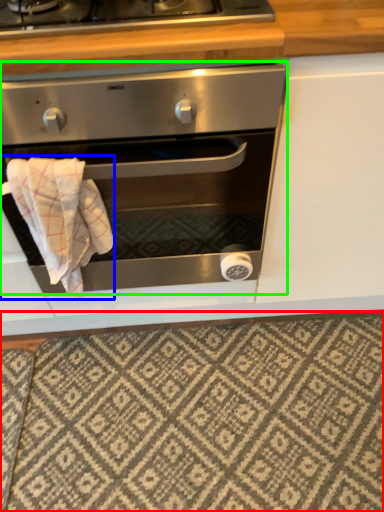
Question: Which is farther away from tile (highlighted by a red box)? bath towel (highlighted by a blue box) or oven (highlighted by a green box)?

Choices:
 (A) bath towel
 (B) oven

Answer: (A)